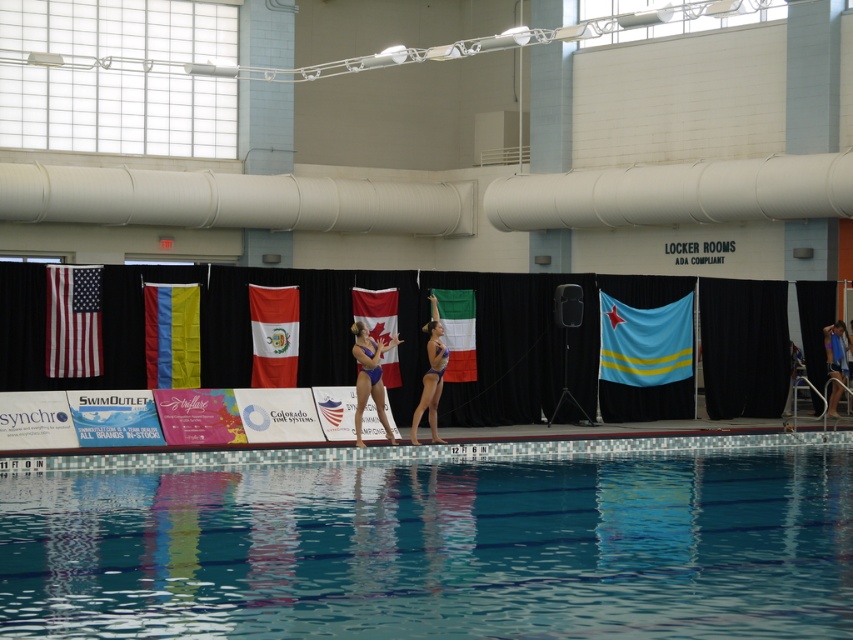
You are a photographer positioned at the center of the pool deck. You need to capture a photo that includes both the american flag at left and the blue swimsuit at right. Which object should you adjust your camera angle to prioritize framing first?

The american flag at left should be prioritized in the frame because its width is larger than the blue swimsuit at right, requiring more space in the composition to accommodate its size.

You are a photographer positioned at the edge of the pool. You notice two points marked in the image, point 1 at coordinates point (364, 346) and point 2 at coordinates point (440, 332). Which point is closer to your current position?

Point (364, 346) is closer to the viewer than point (440, 332), so point 1 is closer to your current position.